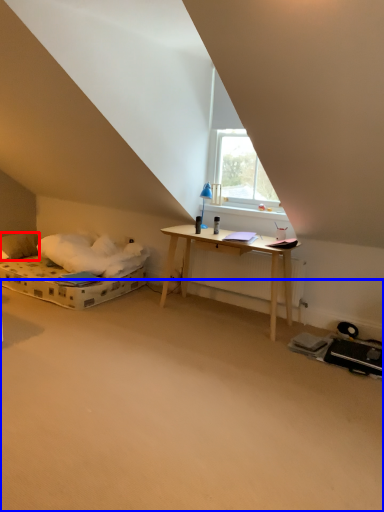
Question: Which object appears closest to the camera in this image, pillow (highlighted by a red box) or plain (highlighted by a blue box)?

Choices:
 (A) pillow
 (B) plain

Answer: (B)